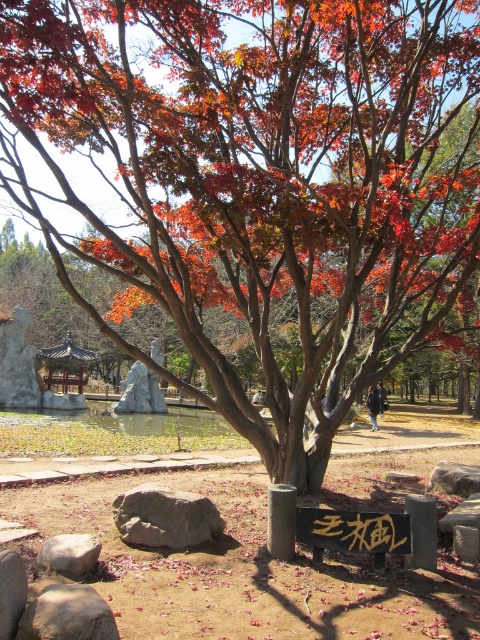
Question: Which point is farther to the camera?

Choices:
 (A) black stone sign at center
 (B) gray rough rock at center

Answer: (B)

Question: Does gray rough rock at center appear on the right side of smooth gray rock at lower left?

Choices:
 (A) yes
 (B) no

Answer: (A)

Question: Is gray rough rock at center behind smooth gray rock at lower left?

Choices:
 (A) no
 (B) yes

Answer: (B)

Question: Is black stone sign at center closer to camera compared to gray rough stone at lower left?

Choices:
 (A) yes
 (B) no

Answer: (B)

Question: Based on their relative distances, which object is farther from the smooth gray rock at lower left?

Choices:
 (A) gray rough rock at center
 (B) gray rough stone at lower left

Answer: (A)

Question: Based on their relative distances, which object is farther from the smooth gray rock at lower left?

Choices:
 (A) gray rough rock at center
 (B) gray rough stone at lower left
 (C) black stone sign at center

Answer: (C)